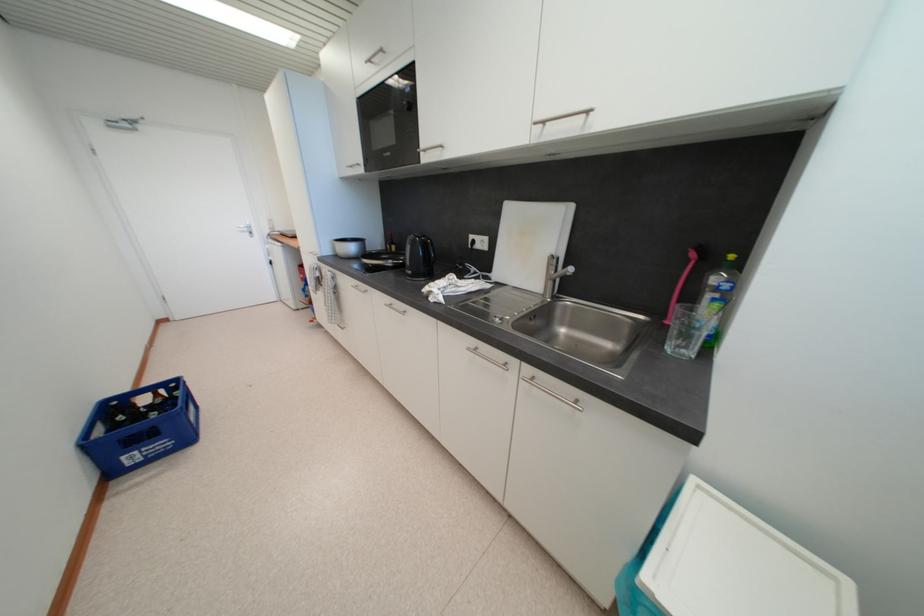
Locate an element on the screen. The height and width of the screenshot is (616, 924). white trash can lid is located at coordinates (742, 569).